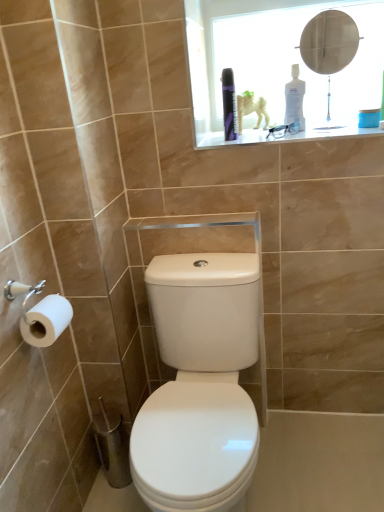
You are a GUI agent. You are given a task and a screenshot of the screen. Output one action in this format:
    pyautogui.click(x=<x>, y=<y>)
    Task: Click on the vacant area that lies in front of white plastic bottle at upper center, positioned as the first toiletry in right-to-left order
    
    Given the screenshot: What is the action you would take?
    click(x=321, y=134)